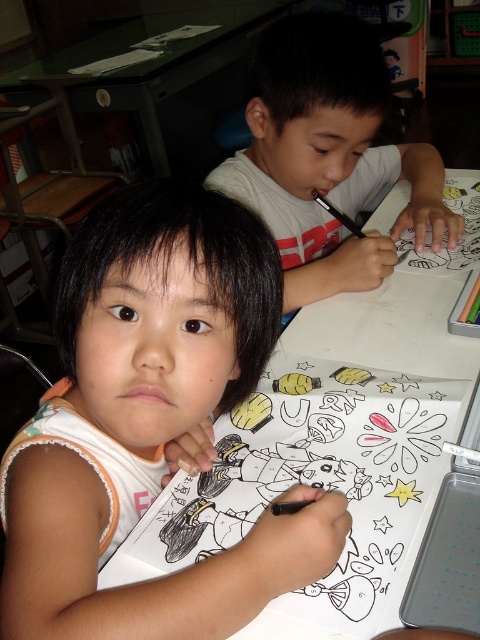
You are a teacher observing two children coloring at a table. You notice two points marked on the image. The first point is at coordinate point [250,483] and the second point is at coordinate point [474,301]. Which point is closer to you?

Point [250,483] is closer to the viewer than point [474,301].

You are a teacher observing the classroom scene. You notice a point marked at coordinates (320, 476) in the image. What object is located at this point?

The point at coordinates (320, 476) marks the location of the black ink pen at upper center.

You are a teacher observing the classroom. You notice the white matte shirt at upper center and the matte green crayon at upper right. Which object is positioned higher in the image?

The white matte shirt at upper center is located above the matte green crayon at upper right, so it is positioned higher in the image.